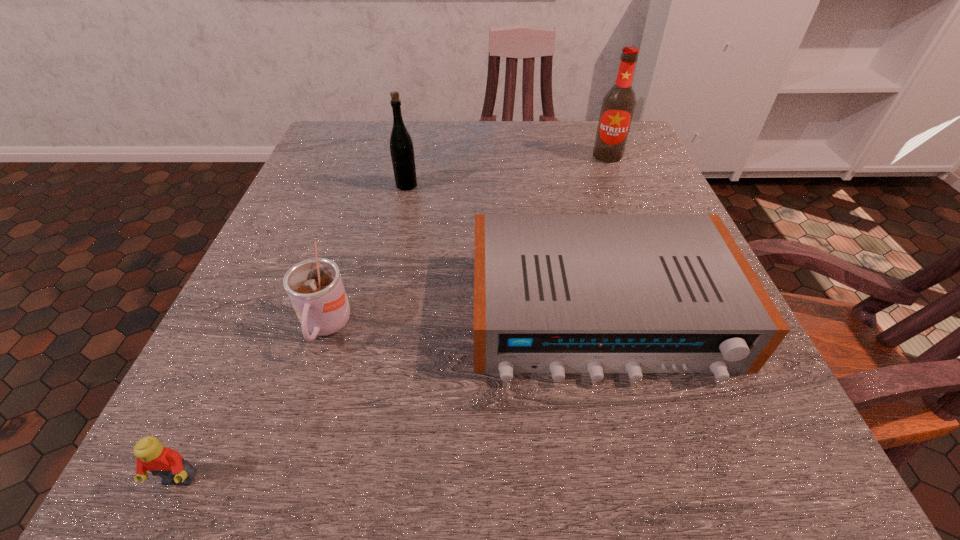
This screenshot has height=540, width=960. What are the coordinates of `vacant space located on the right of the nearer beer bottle` in the screenshot? It's located at (541, 185).

In order to click on vacant area located on the side with the handle of the cup in this screenshot , I will do `click(273, 497)`.

Where is `free space located on the control panel of the radio receiver`? free space located on the control panel of the radio receiver is located at coordinates (641, 475).

Identify the location of object that is at the far edge. This screenshot has width=960, height=540. (618, 105).

At what (x,y) coordinates should I click in order to perform the action: click on object that is positioned at the near edge. Please return your answer as a coordinate pair (x, y). Looking at the image, I should click on (150, 454).

Locate an element on the screen. The width and height of the screenshot is (960, 540). cup located in the left edge section of the desktop is located at coordinates (314, 286).

The width and height of the screenshot is (960, 540). What are the coordinates of `Lego present at the left edge` in the screenshot? It's located at (150, 454).

Identify the location of beer bottle that is at the right edge. The image size is (960, 540). (618, 105).

This screenshot has height=540, width=960. Find the location of `radio receiver at the right edge`. radio receiver at the right edge is located at coordinates (553, 293).

The height and width of the screenshot is (540, 960). In order to click on object present at the near left corner in this screenshot , I will do `click(150, 454)`.